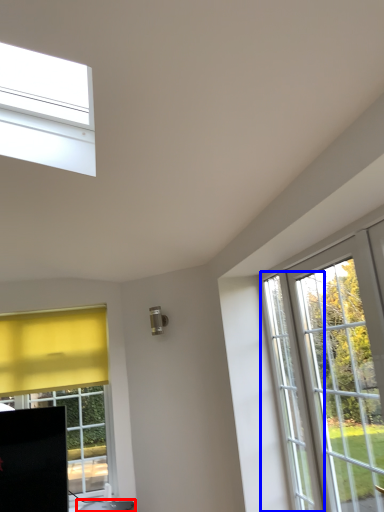
Question: Which point is further to the camera, furniture (highlighted by a red box) or screen door (highlighted by a blue box)?

Choices:
 (A) furniture
 (B) screen door

Answer: (A)